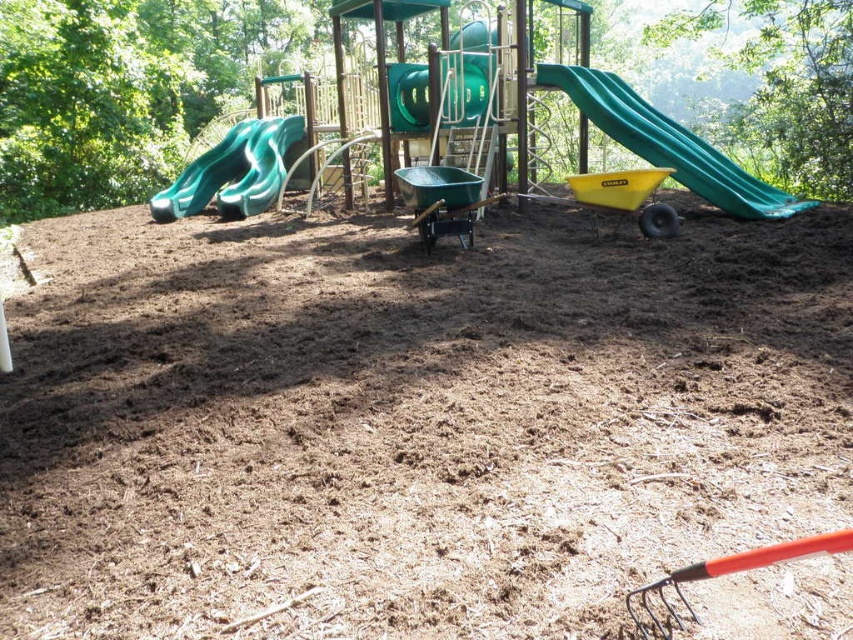
You are a gardener who needs to place a new flower bed in the playground area. The flower bed requires a spot with specific coordinates. According to the image, where exactly is the brown mulch at center located?

The brown mulch at center is located at point coordinates of (409, 420).

You are a gardener who needs to move the STANLEY wheelbarrow from its current position to the brown mulch at center. Which direction should you move it relative to the green rubber slide at left?

The brown mulch at center is to the right of the green rubber slide at left, so you should move the STANLEY wheelbarrow to the right side of the green rubber slide at left to reach the brown mulch at center.

You are a gardener who needs to transport some mulch from the center area to the slide at the right. Given that your wheelbarrow can carry up to 1 meter in width of mulch, can you safely move the mulch from the brown mulch at center to the green plastic slide at right without exceeding the width capacity?

The brown mulch at center is narrower than the green plastic slide at right. Since the mulch is less than 1 meter in width, the gardener can safely transport it using the wheelbarrow without exceeding the width capacity.